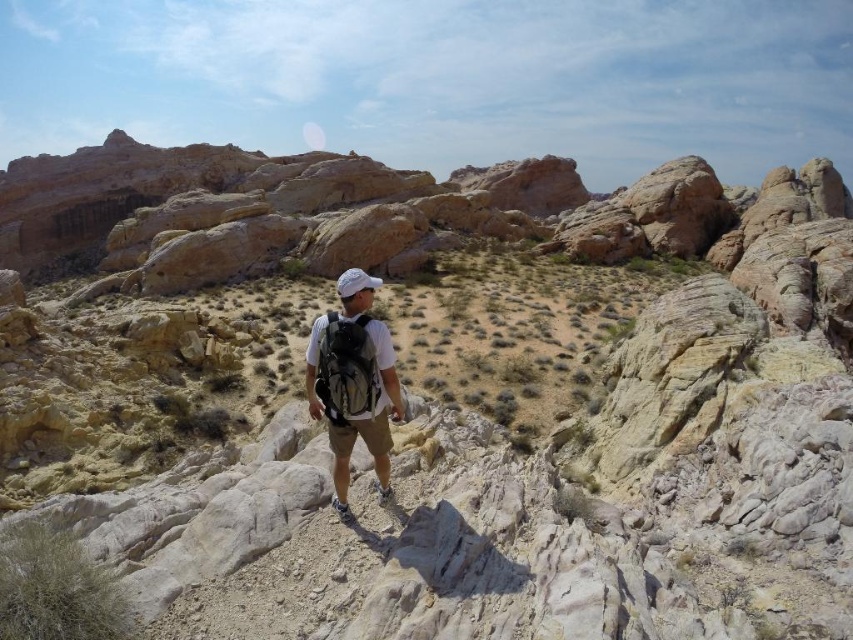
Can you confirm if white matte backpack at center is thinner than matte gray backpack at center?

In fact, white matte backpack at center might be wider than matte gray backpack at center.

Can you confirm if white matte backpack at center is positioned to the left of matte gray backpack at center?

Correct, you'll find white matte backpack at center to the left of matte gray backpack at center.

You are a GUI agent. You are given a task and a screenshot of the screen. Output one action in this format:
    pyautogui.click(x=<x>, y=<y>)
    Task: Click on the white matte backpack at center
    This screenshot has width=853, height=640.
    Given the screenshot: What is the action you would take?
    pyautogui.click(x=352, y=381)